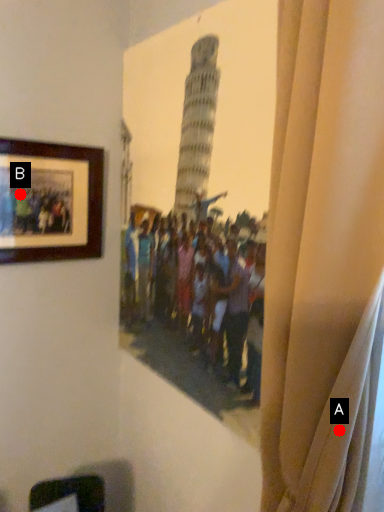
Question: Two points are circled on the image, labeled by A and B beside each circle. Which point appears closest to the camera in this image?

Choices:
 (A) A is closer
 (B) B is closer

Answer: (A)